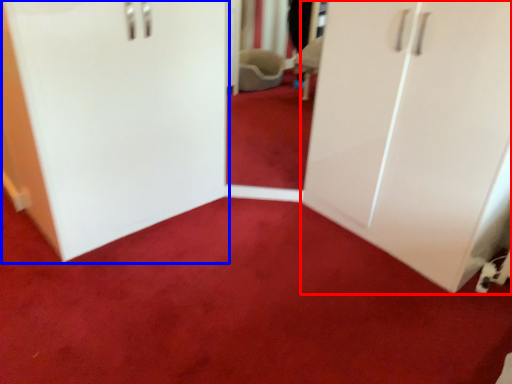
Question: Which point is further to the camera, cupboard (highlighted by a red box) or door (highlighted by a blue box)?

Choices:
 (A) cupboard
 (B) door

Answer: (B)